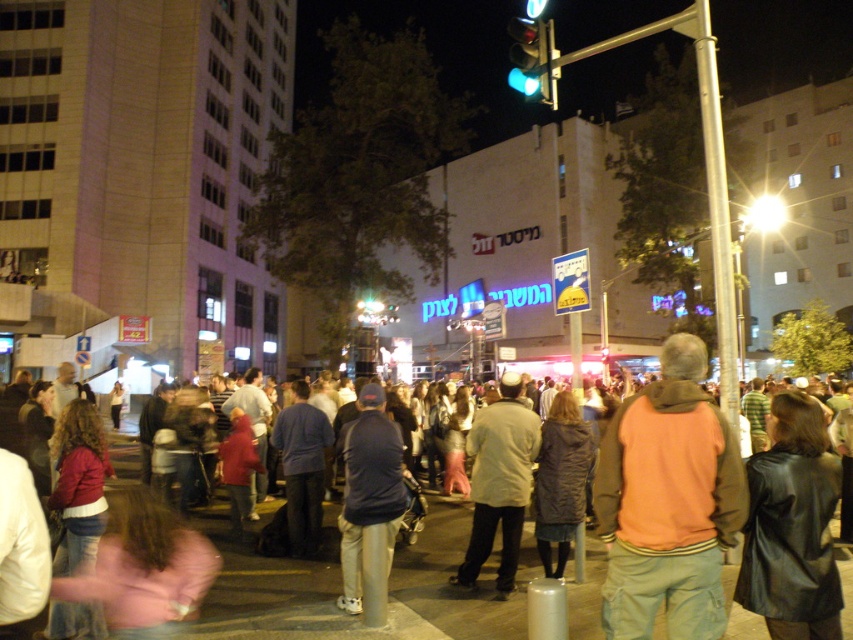
Question: Which of the following is the farthest from the observer?

Choices:
 (A) (241, 573)
 (B) (489, 461)
 (C) (370, 616)
 (D) (514, 52)

Answer: (D)

Question: Considering the relative positions of dark gray jacket at center and light brown leather jacket at center in the image provided, where is dark gray jacket at center located with respect to light brown leather jacket at center?

Choices:
 (A) right
 (B) left

Answer: (B)

Question: Which point appears closest to the camera in this image?

Choices:
 (A) (749, 561)
 (B) (456, 502)
 (C) (511, 589)
 (D) (606, 435)

Answer: (D)

Question: Based on their relative distances, which object is nearer to the dark blue jacket at center?

Choices:
 (A) black leather jacket at lower right
 (B) light brown leather jacket at center
 (C) dark gray jacket at center
 (D) orange fleece jacket at center

Answer: (B)

Question: Can you confirm if dark gray jacket at center is positioned to the left of green glass traffic light at upper center?

Choices:
 (A) yes
 (B) no

Answer: (A)

Question: Can you confirm if orange fleece jacket at center is positioned below dark gray jacket at center?

Choices:
 (A) no
 (B) yes

Answer: (A)